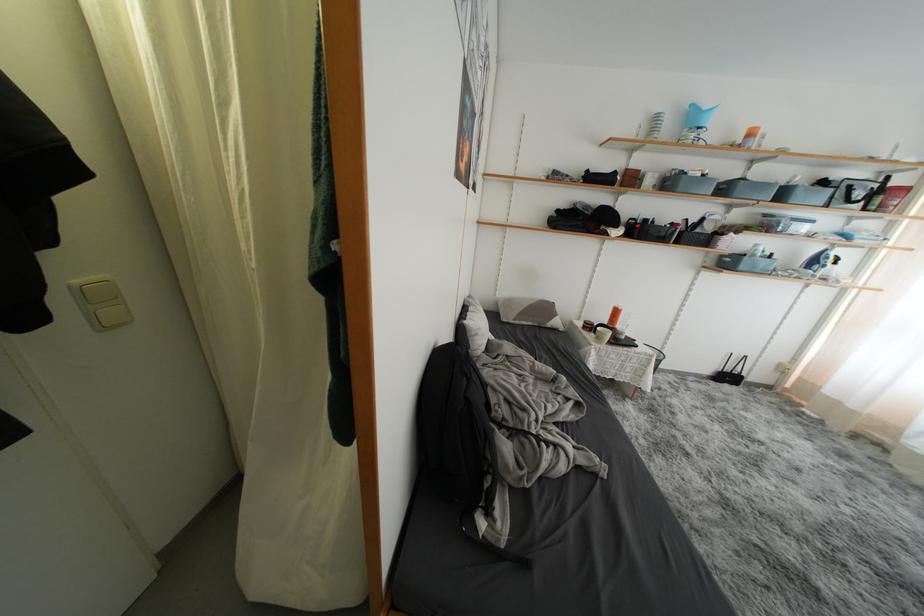
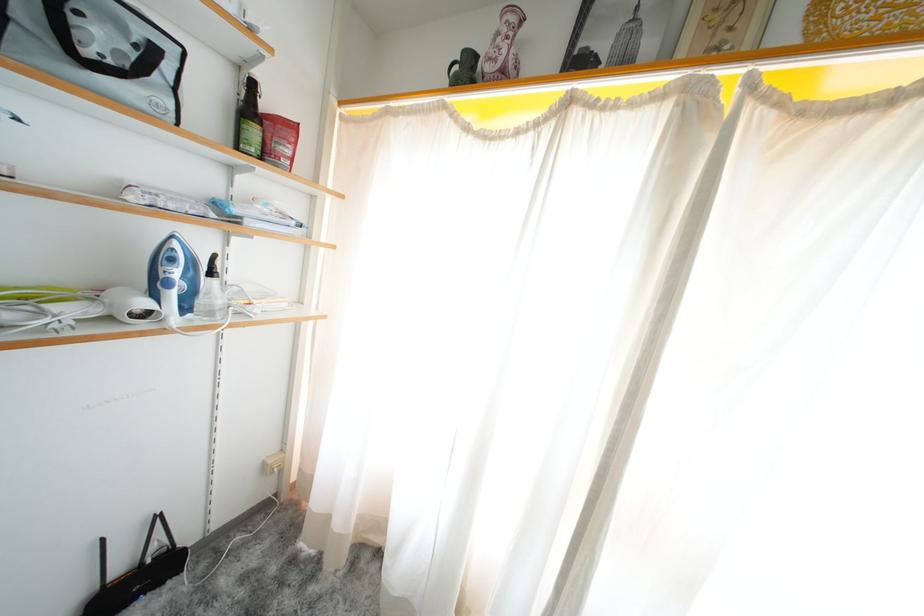
Locate, in the second image, the point that corresponds to point (889, 212) in the first image.

(273, 158)